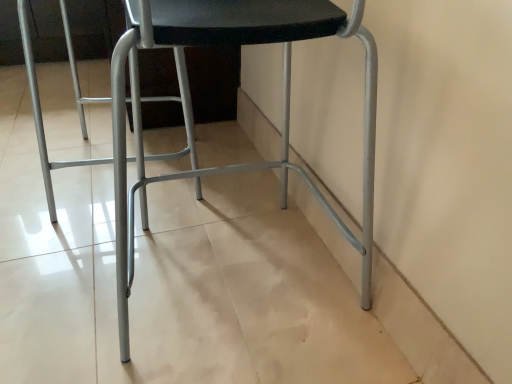
Describe the element at coordinates (191, 135) in the screenshot. I see `metallic gray chair at center` at that location.

Identify the location of metallic gray chair at center. (191, 135).

What is the approximate height of metallic gray chair at center?

metallic gray chair at center is 26.02 inches in height.

Identify the location of metallic silver swivel chair at center. The image size is (512, 384). (161, 96).

What is the approximate height of metallic silver swivel chair at center?

It is 22.54 inches.

The height and width of the screenshot is (384, 512). What do you see at coordinates (161, 96) in the screenshot?
I see `metallic silver swivel chair at center` at bounding box center [161, 96].

You are a GUI agent. You are given a task and a screenshot of the screen. Output one action in this format:
    pyautogui.click(x=<x>, y=<y>)
    Task: Click on the metallic gray chair at center
    The height and width of the screenshot is (384, 512).
    Given the screenshot: What is the action you would take?
    pyautogui.click(x=191, y=135)

Considering the positions of objects metallic gray chair at center and metallic silver swivel chair at center in the image provided, who is more to the right, metallic gray chair at center or metallic silver swivel chair at center?

metallic gray chair at center is more to the right.

Which is behind, metallic gray chair at center or metallic silver swivel chair at center?

metallic silver swivel chair at center is behind.

Which point is more distant from viewer, (366, 291) or (192, 148)?

Positioned behind is point (192, 148).

From the image's perspective, is metallic gray chair at center on metallic silver swivel chair at center?

No, from the image's perspective, metallic gray chair at center is not over metallic silver swivel chair at center.

From a real-world perspective, relative to metallic silver swivel chair at center, is metallic gray chair at center vertically above or below?

In terms of real-world spatial position, metallic gray chair at center is above metallic silver swivel chair at center.

Does metallic gray chair at center have a lesser width compared to metallic silver swivel chair at center?

Yes, metallic gray chair at center is thinner than metallic silver swivel chair at center.

Considering the relative sizes of metallic gray chair at center and metallic silver swivel chair at center in the image provided, is metallic gray chair at center shorter than metallic silver swivel chair at center?

In fact, metallic gray chair at center may be taller than metallic silver swivel chair at center.

Considering the relative sizes of metallic gray chair at center and metallic silver swivel chair at center in the image provided, is metallic gray chair at center smaller than metallic silver swivel chair at center?

Indeed, metallic gray chair at center has a smaller size compared to metallic silver swivel chair at center.

Is metallic silver swivel chair at center inside metallic gray chair at center?

No, metallic silver swivel chair at center is not surrounded by metallic gray chair at center.

Is metallic gray chair at center placed right next to metallic silver swivel chair at center?

No, metallic gray chair at center is not in contact with metallic silver swivel chair at center.

Is metallic gray chair at center oriented towards metallic silver swivel chair at center?

Yes, metallic gray chair at center faces towards metallic silver swivel chair at center.

Find the location of a particular element. The width and height of the screenshot is (512, 384). swivel chair located behind the metallic gray chair at center is located at coordinates (161, 96).

Considering the positions of objects metallic silver swivel chair at center and metallic gray chair at center in the image provided, who is more to the left, metallic silver swivel chair at center or metallic gray chair at center?

From the viewer's perspective, metallic silver swivel chair at center appears more on the left side.

Who is more distant, metallic silver swivel chair at center or metallic gray chair at center?

metallic silver swivel chair at center.

Does point (45, 185) appear closer or farther from the camera than point (366, 237)?

Clearly, point (45, 185) is more distant from the camera than point (366, 237).

From the image's perspective, which one is positioned lower, metallic silver swivel chair at center or metallic gray chair at center?

metallic gray chair at center.

From a real-world perspective, is metallic silver swivel chair at center located beneath metallic gray chair at center?

Yes, from a real-world perspective, metallic silver swivel chair at center is under metallic gray chair at center.

Between metallic silver swivel chair at center and metallic gray chair at center, which one has smaller width?

Thinner between the two is metallic gray chair at center.

Does metallic silver swivel chair at center have a lesser height compared to metallic gray chair at center?

Yes.

Does metallic silver swivel chair at center have a smaller size compared to metallic gray chair at center?

No.

Consider the image. Choose the correct answer: Is metallic silver swivel chair at center inside metallic gray chair at center or outside it?

metallic silver swivel chair at center is outside metallic gray chair at center.

Is metallic silver swivel chair at center next to metallic gray chair at center and touching it?

They are not placed beside each other.

Could you tell me if metallic silver swivel chair at center is facing metallic gray chair at center?

No, metallic silver swivel chair at center is not turned towards metallic gray chair at center.

What's the angular difference between metallic silver swivel chair at center and metallic gray chair at center's facing directions?

There is a 96.1-degree angle between the facing directions of metallic silver swivel chair at center and metallic gray chair at center.

Image resolution: width=512 pixels, height=384 pixels. What are the coordinates of `chair to the right of metallic silver swivel chair at center` in the screenshot? It's located at (191, 135).

Image resolution: width=512 pixels, height=384 pixels. I want to click on swivel chair above the metallic gray chair at center (from the image's perspective), so click(161, 96).

This screenshot has height=384, width=512. What are the coordinates of `swivel chair behind the metallic gray chair at center` in the screenshot? It's located at (161, 96).